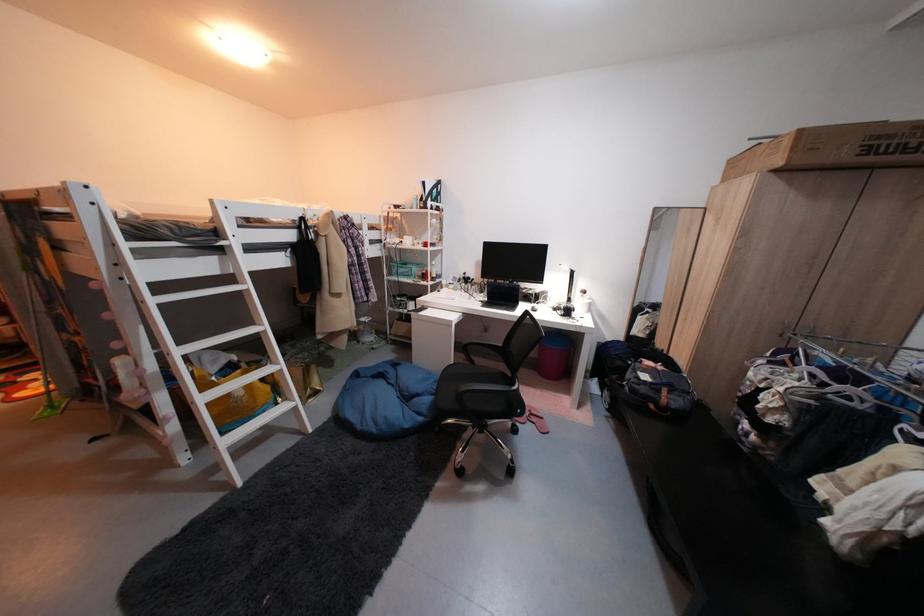
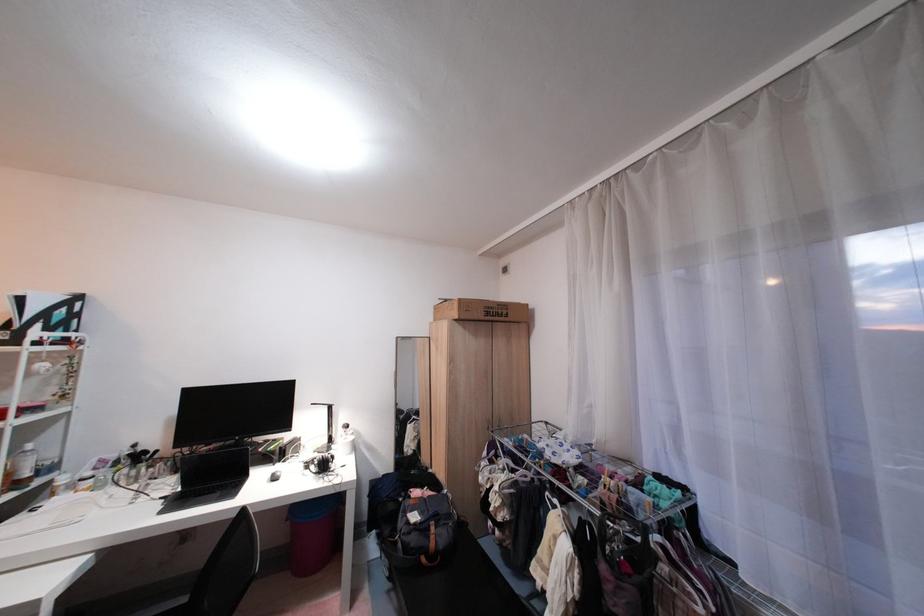
Locate, in the second image, the point that corresponds to [566,313] in the first image.

(320, 472)